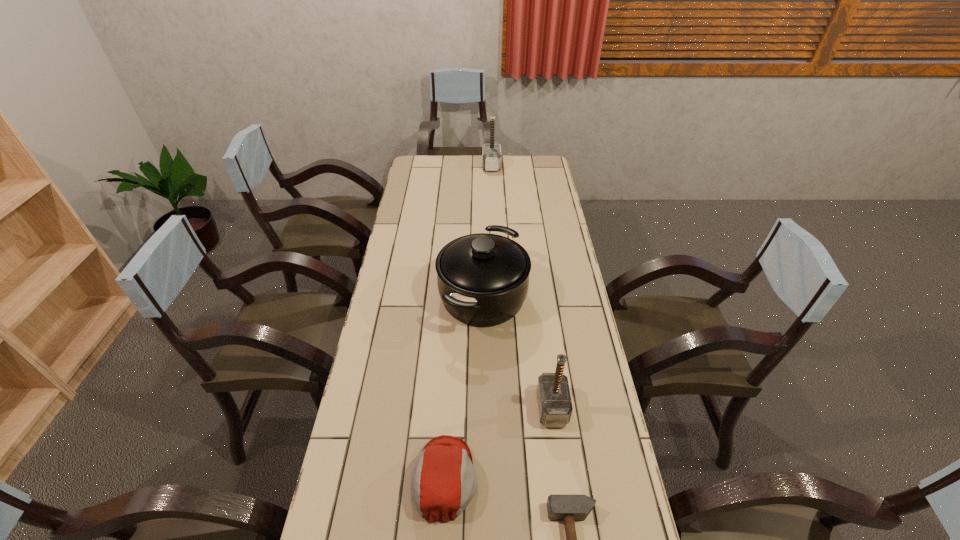
Find the location of `vacant area situated on the front-facing side of the cap`. vacant area situated on the front-facing side of the cap is located at coordinates (602, 478).

Find the location of a particular element. This screenshot has height=540, width=960. object that is positioned at the far edge is located at coordinates (491, 155).

Locate an element on the screen. The image size is (960, 540). object that is at the right edge is located at coordinates (555, 408).

In the image, there is a desktop. Identify the location of vacant space at the far edge. The image size is (960, 540). (517, 172).

In the image, there is a desktop. Identify the location of vacant region at the left edge. (385, 345).

Identify the location of vacant region at the right edge of the desktop. This screenshot has width=960, height=540. (530, 235).

The height and width of the screenshot is (540, 960). In order to click on vacant space at the far right corner of the desktop in this screenshot , I will do `click(518, 156)`.

Find the location of a particular element. The image size is (960, 540). vacant area that lies between the second shortest object and the second farthest hammer is located at coordinates (x=498, y=443).

Identify the location of free space between the second shortest object and the second farthest hammer. The height and width of the screenshot is (540, 960). point(498,443).

I want to click on empty space between the saucepan and the third farthest object, so click(517, 353).